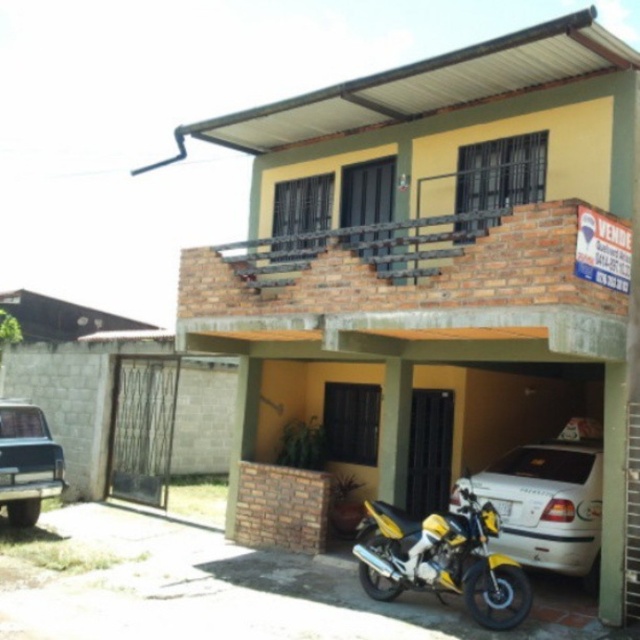
Between point (493, 499) and point (481, 624), which one is positioned behind?

The point (493, 499) is behind.

Who is positioned more to the left, white matte car at lower right or yellow matte motorcycle at lower center?

yellow matte motorcycle at lower center is more to the left.

Between point (557, 493) and point (445, 570), which one is positioned in front?

Point (445, 570) is more forward.

This screenshot has width=640, height=640. I want to click on white matte car at lower right, so tap(547, 500).

Based on the photo, does yellow matte motorcycle at lower center have a greater height compared to matte black truck at lower left?

No.

Is point (433, 524) closer to viewer compared to point (58, 448)?

Yes, point (433, 524) is closer to viewer.

I want to click on yellow matte motorcycle at lower center, so click(x=442, y=561).

Who is shorter, white matte car at lower right or matte black truck at lower left?

Standing shorter between the two is white matte car at lower right.

Which is behind, point (520, 486) or point (29, 404)?

Point (29, 404)

The height and width of the screenshot is (640, 640). I want to click on white matte car at lower right, so click(547, 500).